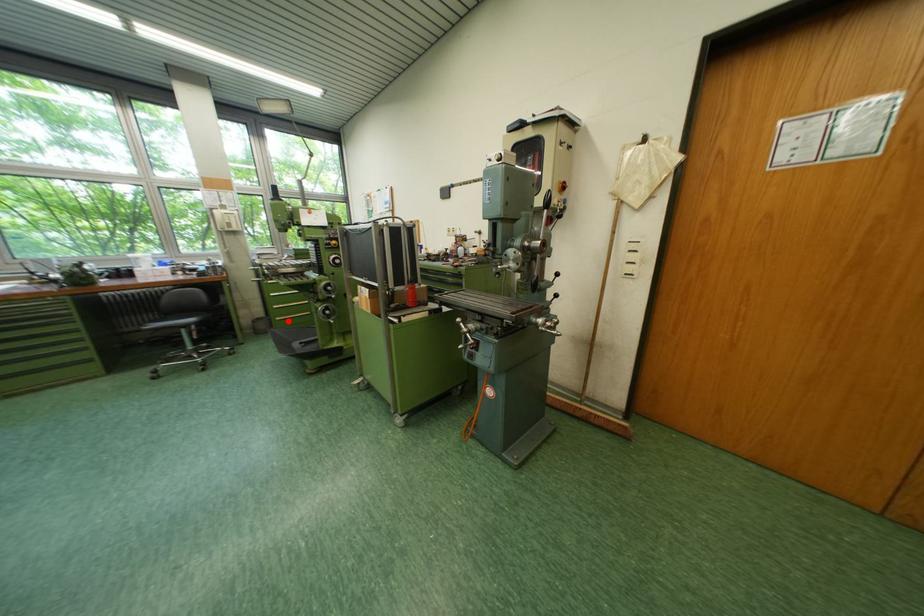
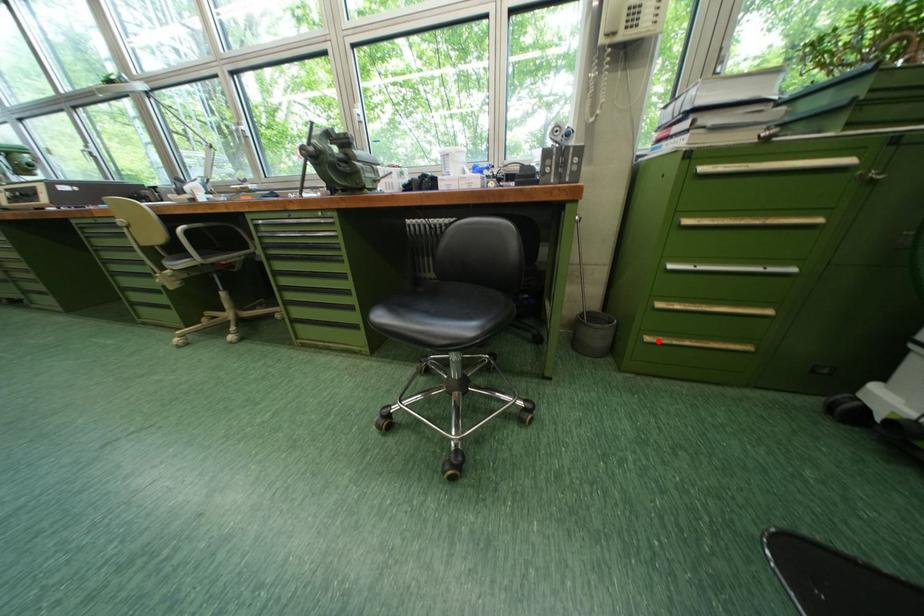
I am providing you with two images of the same scene from different viewpoints. A red point is marked on the first image and another point is marked on the second image. Do the highlighted points in image1 and image2 indicate the same real-world spot?

Yes